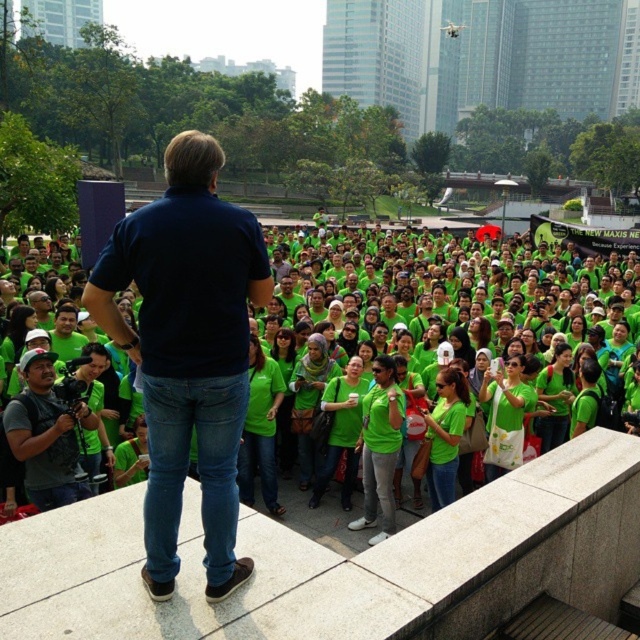
Question: Can you confirm if dark blue cotton shirt at center is positioned to the left of matte black camera at lower left?

Choices:
 (A) no
 (B) yes

Answer: (A)

Question: Which of the following is the closest to the observer?

Choices:
 (A) dark blue cotton shirt at center
 (B) green fabric shirts at center
 (C) matte black camera at lower left

Answer: (A)

Question: Which is farther from the green fabric shirts at center?

Choices:
 (A) matte black camera at lower left
 (B) dark blue cotton shirt at center

Answer: (B)

Question: Is green fabric shirts at center wider than matte black camera at lower left?

Choices:
 (A) yes
 (B) no

Answer: (A)

Question: Can you confirm if green fabric shirts at center is wider than dark blue cotton shirt at center?

Choices:
 (A) yes
 (B) no

Answer: (A)

Question: Among these points, which one is farthest from the camera?

Choices:
 (A) [x=60, y=502]
 (B) [x=321, y=380]
 (C) [x=164, y=490]

Answer: (B)